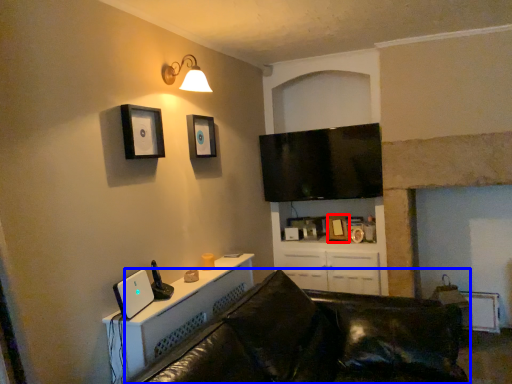
Question: Which point is further to the camera, picture frame (highlighted by a red box) or studio couch (highlighted by a blue box)?

Choices:
 (A) picture frame
 (B) studio couch

Answer: (A)